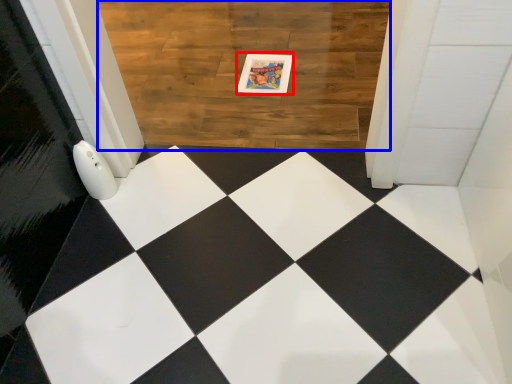
Question: Which object appears farthest to the camera in this image, postcard (highlighted by a red box) or square (highlighted by a blue box)?

Choices:
 (A) postcard
 (B) square

Answer: (A)